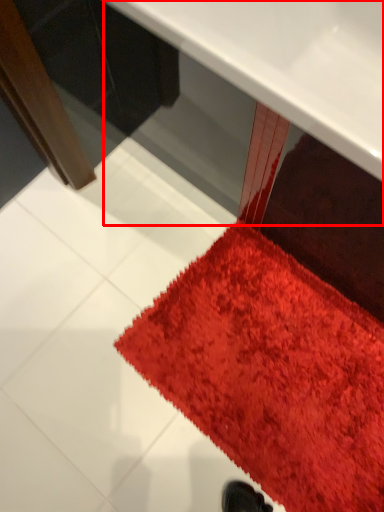
Question: Considering the relative positions of table (annotated by the red box) and mat in the image provided, where is table (annotated by the red box) located with respect to the staircase?

Choices:
 (A) left
 (B) right

Answer: (B)